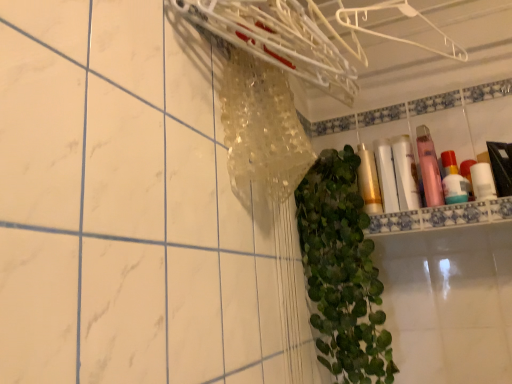
Question: From a real-world perspective, is green leafy plant at center on top of clear plastic hanger at upper center, the 1th hanger when ordered from left to right?

Choices:
 (A) yes
 (B) no

Answer: (B)

Question: Is green leafy plant at center positioned with its back to clear plastic hanger at upper center, the 1th hanger when ordered from left to right?

Choices:
 (A) no
 (B) yes

Answer: (A)

Question: Considering the relative sizes of green leafy plant at center and clear plastic hanger at upper center, the 1th hanger when ordered from left to right, in the image provided, is green leafy plant at center wider than clear plastic hanger at upper center, the 1th hanger when ordered from left to right,?

Choices:
 (A) yes
 (B) no

Answer: (A)

Question: Can you confirm if green leafy plant at center is smaller than clear plastic hanger at upper center, which is the second hanger from right to left?

Choices:
 (A) no
 (B) yes

Answer: (A)

Question: From the image's perspective, is green leafy plant at center over clear plastic hanger at upper center, which is the second hanger from right to left?

Choices:
 (A) yes
 (B) no

Answer: (B)

Question: Is gold metallic lotion at center, acting as the 6th toiletry starting from the right, situated inside pink matte bottle at upper right, which appears as the second toiletry when viewed from the right, or outside?

Choices:
 (A) inside
 (B) outside

Answer: (B)

Question: From the image's perspective, relative to pink matte bottle at upper right, which appears as the second toiletry when viewed from the right, is gold metallic lotion at center, acting as the 6th toiletry starting from the right, above or below?

Choices:
 (A) below
 (B) above

Answer: (B)

Question: Does point (380, 203) appear closer or farther from the camera than point (443, 178)?

Choices:
 (A) closer
 (B) farther

Answer: (B)

Question: From a real-world perspective, is gold metallic lotion at center, acting as the 6th toiletry starting from the right, positioned above or below pink matte bottle at upper right, which appears as the second toiletry when viewed from the right?

Choices:
 (A) above
 (B) below

Answer: (A)

Question: Visually, is green leafy plant at center positioned to the left or to the right of gold metallic lotion at center, acting as the 6th toiletry starting from the right?

Choices:
 (A) right
 (B) left

Answer: (B)

Question: Does point (313, 246) appear closer or farther from the camera than point (373, 188)?

Choices:
 (A) farther
 (B) closer

Answer: (B)

Question: From their relative heights in the image, would you say green leafy plant at center is taller or shorter than gold metallic lotion at center, acting as the 6th toiletry starting from the right?

Choices:
 (A) short
 (B) tall

Answer: (B)

Question: Looking at their shapes, would you say green leafy plant at center is wider or thinner than gold metallic lotion at center, acting as the 6th toiletry starting from the right?

Choices:
 (A) wide
 (B) thin

Answer: (A)

Question: Considering the positions of white plastic hanger at upper center, the first hanger positioned from the right, and clear plastic hanger at upper center, which is the second hanger from right to left, in the image, is white plastic hanger at upper center, the first hanger positioned from the right, taller or shorter than clear plastic hanger at upper center, which is the second hanger from right to left,?

Choices:
 (A) short
 (B) tall

Answer: (A)

Question: Choose the correct answer: Is white plastic hanger at upper center, the first hanger positioned from the right, inside clear plastic hanger at upper center, which is the second hanger from right to left, or outside it?

Choices:
 (A) outside
 (B) inside

Answer: (A)